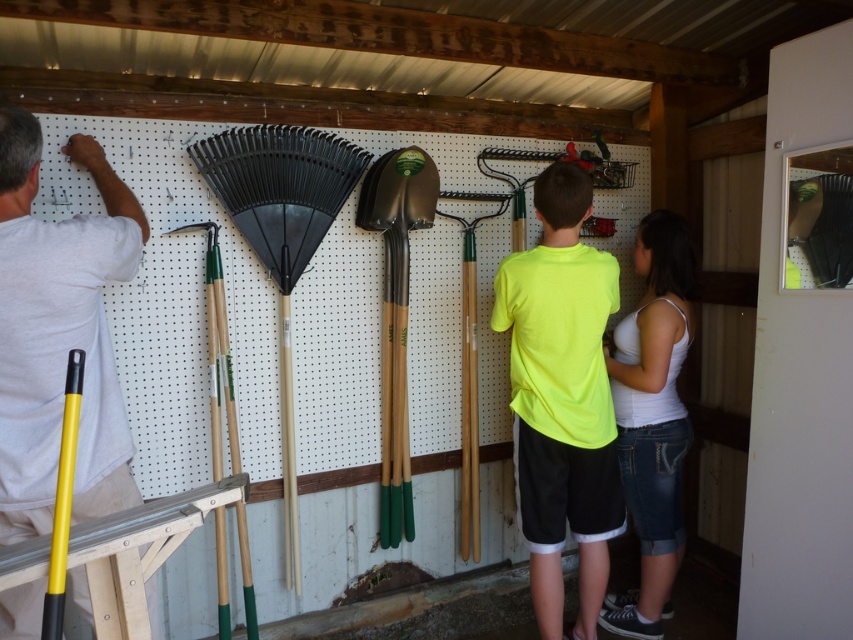
Between white cotton tank top at center and green wooden shovel at center, which one has more height?

white cotton tank top at center is taller.

Who is more distant from viewer, [659,253] or [416,189]?

The point [416,189] is behind.

Does point (637, 440) lie in front of point (387, 285)?

Yes, it is in front of point (387, 285).

This screenshot has height=640, width=853. Identify the location of white cotton tank top at center. (653, 419).

This screenshot has width=853, height=640. Identify the location of white t-shirt at left. (59, 333).

This screenshot has width=853, height=640. What do you see at coordinates (59, 333) in the screenshot? I see `white t-shirt at left` at bounding box center [59, 333].

This screenshot has height=640, width=853. Find the location of `white t-shirt at left`. white t-shirt at left is located at coordinates (59, 333).

Can you confirm if neon yellow t-shirt at center is smaller than white cotton tank top at center?

Incorrect, neon yellow t-shirt at center is not smaller in size than white cotton tank top at center.

Looking at this image, between neon yellow t-shirt at center and white cotton tank top at center, which one is positioned higher?

neon yellow t-shirt at center is above.

Is point (613, 444) less distant than point (628, 477)?

Yes, point (613, 444) is in front of point (628, 477).

Locate an element on the screen. The image size is (853, 640). neon yellow t-shirt at center is located at coordinates (561, 397).